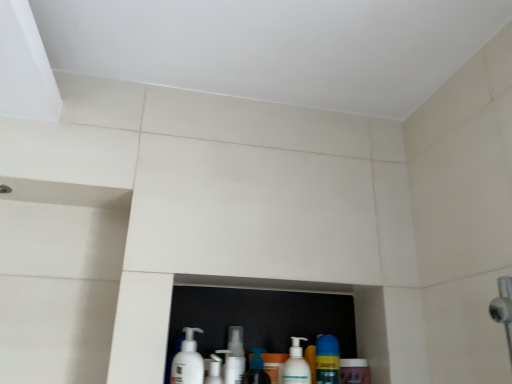
Question: In the image, is yellow matte bottle at lower center, the 5th cleaning product when ordered from left to right, positioned in front of or behind translucent plastic soap dispenser at center, acting as the 3th cleaning product starting from the right?

Choices:
 (A) front
 (B) behind

Answer: (B)

Question: In terms of size, does yellow matte bottle at lower center, the 5th cleaning product when ordered from left to right, appear bigger or smaller than translucent plastic soap dispenser at center, which is counted as the third cleaning product, starting from the left?

Choices:
 (A) big
 (B) small

Answer: (B)

Question: Which of these objects is positioned closest to the white plastic bottles at lower center?

Choices:
 (A) yellow matte bottle at lower center, the 5th cleaning product when ordered from left to right
 (B) white plastic cup at center, the fourth cleaning product when ordered from right to left
 (C) translucent plastic soap dispenser at center, acting as the 3th cleaning product starting from the right
 (D) white matte pump bottle at lower center, the 1th cleaning product from the left
 (E) white plastic pump bottle at lower center, placed as the fourth cleaning product when sorted from left to right

Answer: (A)

Question: Which object is positioned farthest from the white plastic bottles at lower center?

Choices:
 (A) white matte pump bottle at lower center, the 1th cleaning product from the left
 (B) white plastic pump bottle at lower center, the 2th cleaning product viewed from the right
 (C) yellow matte bottle at lower center, the 5th cleaning product when ordered from left to right
 (D) white plastic cup at center, which is the 2th cleaning product in left-to-right order
 (E) translucent plastic soap dispenser at center, which is counted as the third cleaning product, starting from the left

Answer: (D)